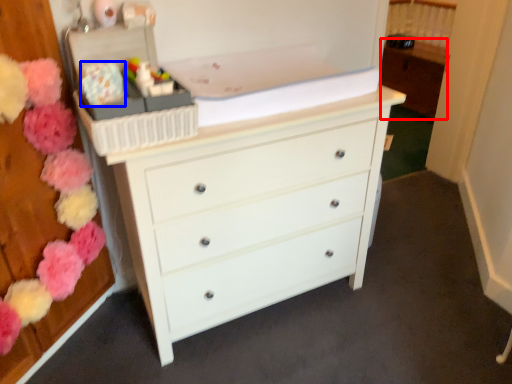
Question: Which of the following is the farthest to the observer, cabinetry (highlighted by a red box) or flower (highlighted by a blue box)?

Choices:
 (A) cabinetry
 (B) flower

Answer: (A)